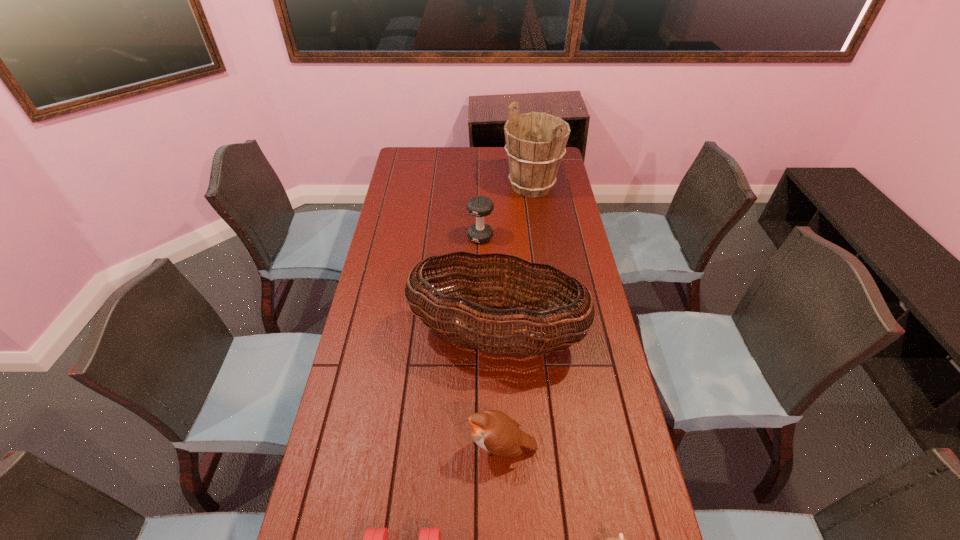
You are a GUI agent. You are given a task and a screenshot of the screen. Output one action in this format:
    pyautogui.click(x=<x>, y=<y>)
    Task: Click on the free space between the tallest object and the right dumbbell
    
    Given the screenshot: What is the action you would take?
    pyautogui.click(x=506, y=212)

Identify the location of free space between the bucket and the fifth shortest object. The width and height of the screenshot is (960, 540). tap(514, 261).

This screenshot has width=960, height=540. Identify the location of free space between the basket and the third nearest object. (498, 392).

You are a GUI agent. You are given a task and a screenshot of the screen. Output one action in this format:
    pyautogui.click(x=<x>, y=<y>)
    Task: Click on the object that is the closest to the fifth shortest object
    This screenshot has width=960, height=540.
    Given the screenshot: What is the action you would take?
    pyautogui.click(x=494, y=431)

Where is `object that is the second nearest to the teddy bear`? This screenshot has width=960, height=540. object that is the second nearest to the teddy bear is located at coordinates (375, 539).

Where is `free space that satisfies the following two spatial constraints: 1. on the front side of the right dumbbell; 2. on the right side of the third farthest object`? This screenshot has width=960, height=540. free space that satisfies the following two spatial constraints: 1. on the front side of the right dumbbell; 2. on the right side of the third farthest object is located at coordinates (480, 336).